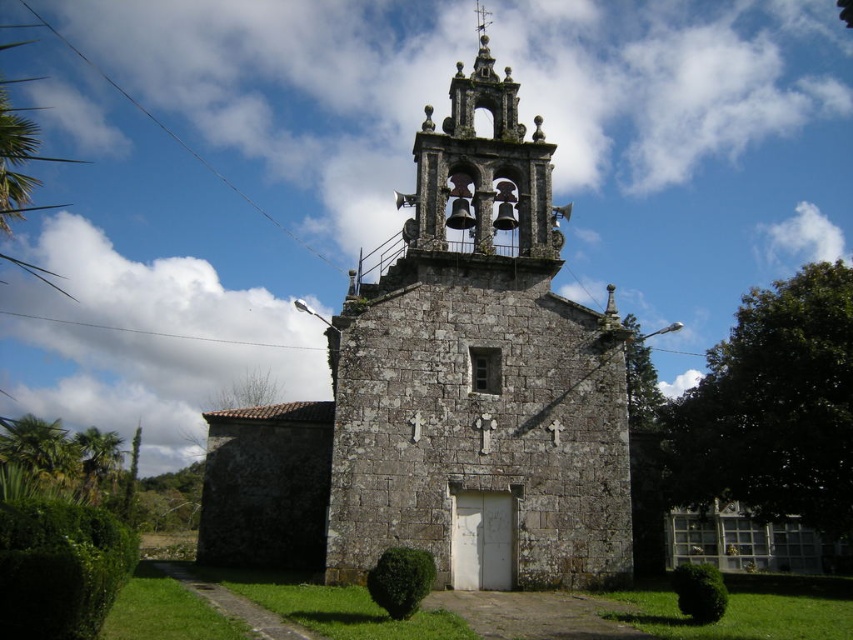
Question: Among these objects, which one is farthest from the camera?

Choices:
 (A) stone bell tower at upper center
 (B) gray stone chapel at center

Answer: (A)

Question: Can you confirm if gray stone chapel at center is positioned above stone bell tower at upper center?

Choices:
 (A) yes
 (B) no

Answer: (B)

Question: Can you confirm if gray stone chapel at center is bigger than stone bell tower at upper center?

Choices:
 (A) yes
 (B) no

Answer: (A)

Question: Can you confirm if gray stone chapel at center is positioned to the right of stone bell tower at upper center?

Choices:
 (A) no
 (B) yes

Answer: (A)